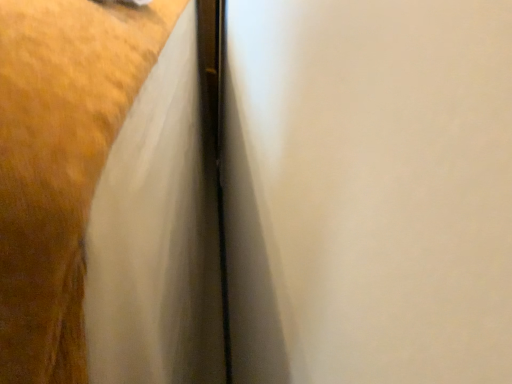
This screenshot has height=384, width=512. Describe the element at coordinates (60, 163) in the screenshot. I see `fuzzy yellow dog at left` at that location.

Find the location of a particular element. This screenshot has height=384, width=512. fuzzy yellow dog at left is located at coordinates (60, 163).

Locate an element on the screen. This screenshot has width=512, height=384. fuzzy yellow dog at left is located at coordinates (60, 163).